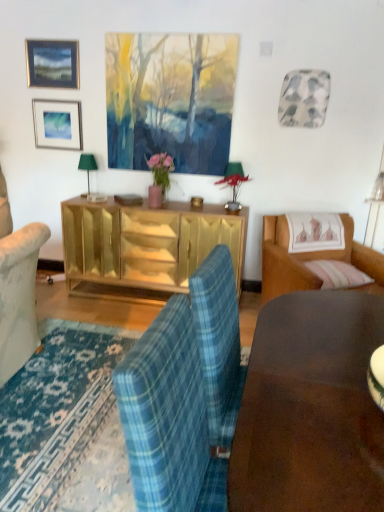
Question: Is brown leather couch at right smaller than matte black picture frame at upper left, placed as the first picture frame when sorted from top to bottom?

Choices:
 (A) yes
 (B) no

Answer: (B)

Question: Can you confirm if brown leather couch at right is taller than matte black picture frame at upper left, placed as the first picture frame when sorted from top to bottom?

Choices:
 (A) yes
 (B) no

Answer: (A)

Question: Is brown leather couch at right shorter than matte black picture frame at upper left, placed as the first picture frame when sorted from top to bottom?

Choices:
 (A) no
 (B) yes

Answer: (A)

Question: Is brown leather couch at right wider than matte black picture frame at upper left, placed as the first picture frame when sorted from top to bottom?

Choices:
 (A) no
 (B) yes

Answer: (B)

Question: Is brown leather couch at right oriented towards matte black picture frame at upper left, the 2th picture frame from the bottom?

Choices:
 (A) no
 (B) yes

Answer: (A)

Question: Can you confirm if brown leather couch at right is positioned to the left of matte black picture frame at upper left, the 2th picture frame from the bottom?

Choices:
 (A) yes
 (B) no

Answer: (B)

Question: Does gold mirrored cabinet at center have a larger size compared to matte silver picture frame at upper left, marked as the 1th picture frame in a bottom-to-top arrangement?

Choices:
 (A) no
 (B) yes

Answer: (B)

Question: Considering the relative positions of gold mirrored cabinet at center and matte silver picture frame at upper left, placed as the 2th picture frame when sorted from top to bottom, in the image provided, is gold mirrored cabinet at center in front of matte silver picture frame at upper left, placed as the 2th picture frame when sorted from top to bottom,?

Choices:
 (A) yes
 (B) no

Answer: (A)

Question: Is gold mirrored cabinet at center facing towards matte silver picture frame at upper left, placed as the 2th picture frame when sorted from top to bottom?

Choices:
 (A) yes
 (B) no

Answer: (B)

Question: Is matte silver picture frame at upper left, placed as the 2th picture frame when sorted from top to bottom, surrounded by gold mirrored cabinet at center?

Choices:
 (A) no
 (B) yes

Answer: (A)

Question: Does gold mirrored cabinet at center lie behind matte silver picture frame at upper left, marked as the 1th picture frame in a bottom-to-top arrangement?

Choices:
 (A) no
 (B) yes

Answer: (A)

Question: From the image's perspective, is gold mirrored cabinet at center located beneath matte silver picture frame at upper left, placed as the 2th picture frame when sorted from top to bottom?

Choices:
 (A) no
 (B) yes

Answer: (B)

Question: Is matte black picture frame at upper left, placed as the first picture frame when sorted from top to bottom, bigger than matte silver picture frame at upper left, placed as the 2th picture frame when sorted from top to bottom?

Choices:
 (A) yes
 (B) no

Answer: (B)